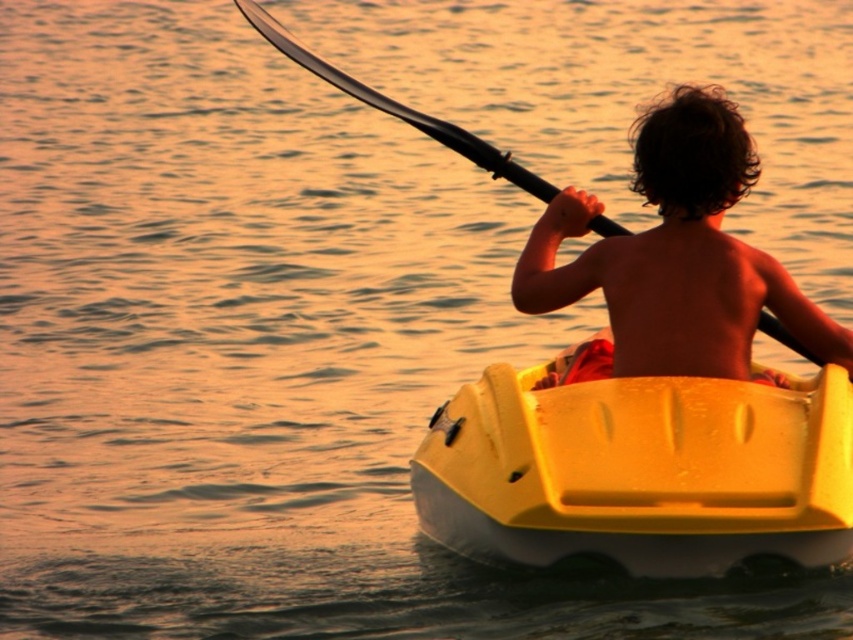
You are a photographer trying to capture the sunset scene. You notice the yellow plastic boat at center and the shiny brown hair at center. Which object is positioned lower in the image?

The yellow plastic boat at center is positioned below the shiny brown hair at center, so it is lower in the image.

You are a photographer trying to capture the silhouette of the person in the kayak. Since the yellow plastic boat at center and shiny brown hair at center are both at the center, which one should you focus on to ensure the silhouette is clear?

The yellow plastic boat at center is wider than shiny brown hair at center, so focusing on the boat will provide a clearer silhouette due to its larger size.